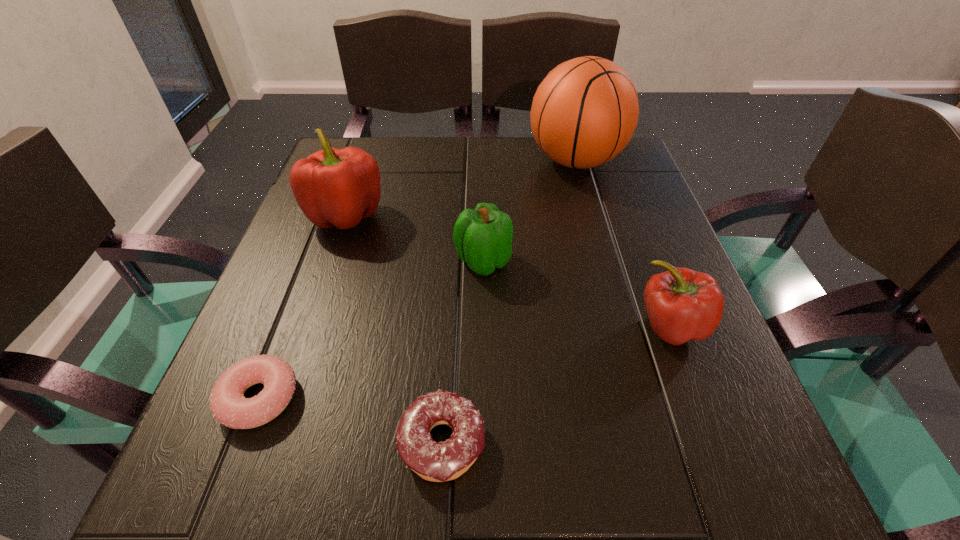
Image resolution: width=960 pixels, height=540 pixels. I want to click on vacant area that lies between the leftmost bell pepper and the nearest bell pepper, so click(508, 271).

Find the location of a particular element. This screenshot has width=960, height=540. object identified as the third closest to the third farthest object is located at coordinates 682,304.

The width and height of the screenshot is (960, 540). I want to click on object that is the nearest to the rightmost bell pepper, so click(483, 237).

Locate which bell pepper ranks in proximity to the leftmost bell pepper. Please provide its 2D coordinates. Your answer should be formatted as a tuple, i.e. [(x, y)], where the tuple contains the x and y coordinates of a point satisfying the conditions above.

[(483, 237)]

Choose which bell pepper is the second nearest neighbor to the second nearest bell pepper. Please provide its 2D coordinates. Your answer should be formatted as a tuple, i.e. [(x, y)], where the tuple contains the x and y coordinates of a point satisfying the conditions above.

[(682, 304)]

Image resolution: width=960 pixels, height=540 pixels. Find the location of `vacant space that satisfies the following two spatial constraints: 1. on the back side of the farthest bell pepper; 2. on the right side of the shorter doughnut`. vacant space that satisfies the following two spatial constraints: 1. on the back side of the farthest bell pepper; 2. on the right side of the shorter doughnut is located at coordinates (329, 215).

What are the coordinates of `vacant space that satisfies the following two spatial constraints: 1. on the back side of the fifth tallest object; 2. on the right side of the fourth nearest object` in the screenshot? It's located at (453, 261).

At what (x,y) coordinates should I click in order to perform the action: click on vacant space that satisfies the following two spatial constraints: 1. on the front side of the second farthest bell pepper; 2. on the left side of the rightmost bell pepper. Please return your answer as a coordinate pair (x, y). This screenshot has height=540, width=960. Looking at the image, I should click on (484, 326).